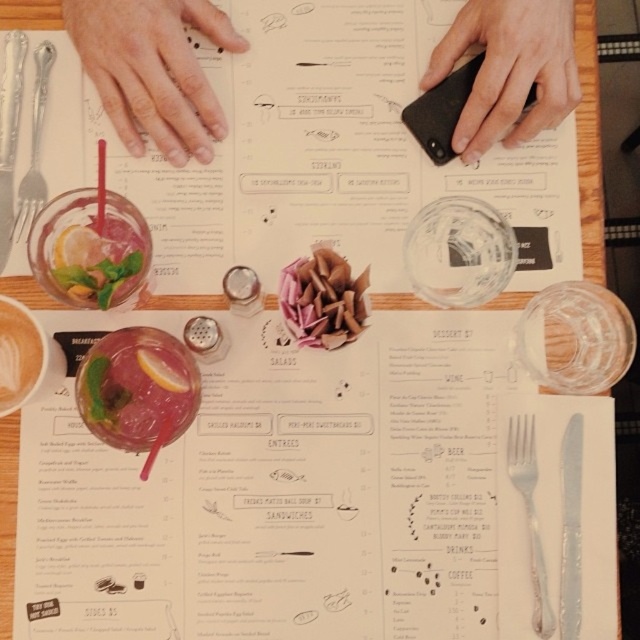
Is matte skin hand at upper center bigger than smooth white coffee cup at lower left?

Yes.

Is matte skin hand at upper center positioned before smooth white coffee cup at lower left?

That is False.

Who is more forward, (x=160, y=60) or (x=13, y=339)?

Point (x=13, y=339) is more forward.

Locate an element on the screen. The height and width of the screenshot is (640, 640). matte skin hand at upper center is located at coordinates (154, 70).

Can you confirm if smooth skin hands at center is smaller than silver metallic fork at center?

No.

This screenshot has height=640, width=640. What do you see at coordinates (154, 70) in the screenshot?
I see `smooth skin hands at center` at bounding box center [154, 70].

This screenshot has width=640, height=640. In order to click on smooth skin hands at center in this screenshot , I will do `click(154, 70)`.

Is pink translucent glass at upper left to the right of translucent glass drink at upper left from the viewer's perspective?

Correct, you'll find pink translucent glass at upper left to the right of translucent glass drink at upper left.

Is point (141, 340) closer to camera compared to point (67, 273)?

No, it is behind (67, 273).

Where is `pink translucent glass at upper left`? This screenshot has width=640, height=640. pink translucent glass at upper left is located at coordinates (138, 388).